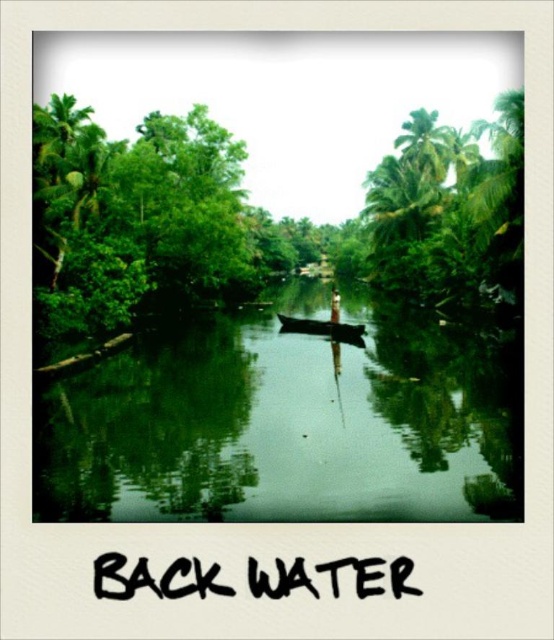
From the picture: You are a photographer planning to capture the reflection of the green smooth water at center and the black wood canoe at center in the canal. Which object will have a larger reflection in the water?

The green smooth water at center has a much taller reflection than the black wood canoe at center, so its reflection will be larger.

You are an observer standing at the edge of the canal. You notice the green leafy tree at upper right and the black wood canoe at center. Which object appears taller in the scene?

The green leafy tree at upper right appears taller than the black wood canoe at center.

You are a photographer trying to capture the boat in the backwater canal. You notice two points marked in the scene. Which point, point [286,470] or point [184,125], is closer to your camera lens?

Point [286,470] is closer to the camera lens than point [184,125].